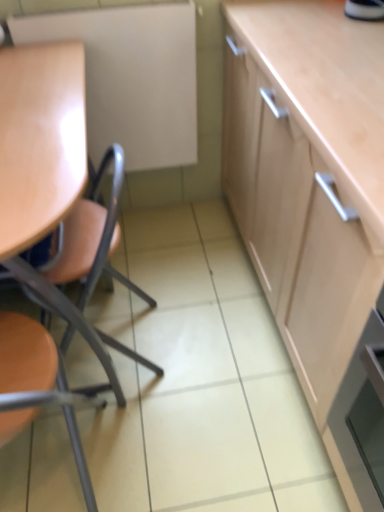
Question: Is matte white board at upper left completely or partially inside matte orange chair at left, which is the 2th chair from top to bottom?

Choices:
 (A) yes
 (B) no

Answer: (B)

Question: Is matte orange chair at left, which is the 2th chair from top to bottom, taller than matte white board at upper left?

Choices:
 (A) yes
 (B) no

Answer: (A)

Question: Does matte orange chair at left, arranged as the 1th chair when ordered from the bottom, turn towards matte white board at upper left?

Choices:
 (A) no
 (B) yes

Answer: (B)

Question: Are matte orange chair at left, arranged as the 1th chair when ordered from the bottom, and matte white board at upper left far apart?

Choices:
 (A) yes
 (B) no

Answer: (A)

Question: Does matte orange chair at left, which is the 2th chair from top to bottom, have a larger size compared to matte white board at upper left?

Choices:
 (A) yes
 (B) no

Answer: (A)

Question: Does matte orange chair at left, which is the 2th chair from top to bottom, appear on the left side of matte white board at upper left?

Choices:
 (A) no
 (B) yes

Answer: (B)

Question: Considering the relative sizes of matte wood chair at left, positioned as the second chair in bottom-to-top order, and matte white board at upper left in the image provided, is matte wood chair at left, positioned as the second chair in bottom-to-top order, bigger than matte white board at upper left?

Choices:
 (A) yes
 (B) no

Answer: (A)

Question: From the image's perspective, does matte wood chair at left, acting as the first chair starting from the top, appear lower than matte white board at upper left?

Choices:
 (A) yes
 (B) no

Answer: (A)

Question: Is matte wood chair at left, acting as the first chair starting from the top, looking in the opposite direction of matte white board at upper left?

Choices:
 (A) yes
 (B) no

Answer: (B)

Question: Is matte wood chair at left, positioned as the second chair in bottom-to-top order, thinner than matte white board at upper left?

Choices:
 (A) yes
 (B) no

Answer: (B)

Question: Is matte wood chair at left, positioned as the second chair in bottom-to-top order, positioned far away from matte white board at upper left?

Choices:
 (A) yes
 (B) no

Answer: (B)

Question: Is matte white board at upper left a part of matte wood chair at left, acting as the first chair starting from the top?

Choices:
 (A) no
 (B) yes

Answer: (A)

Question: Does matte white board at upper left have a smaller size compared to matte orange chair at left, arranged as the 1th chair when ordered from the bottom?

Choices:
 (A) no
 (B) yes

Answer: (B)